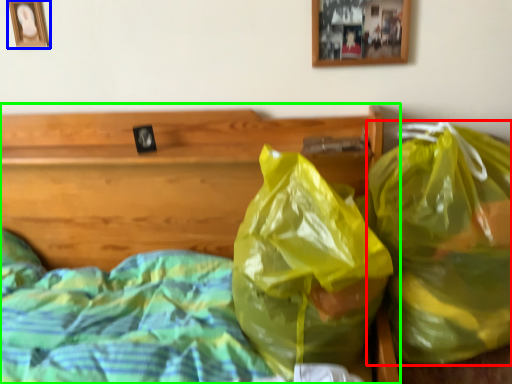
Question: Which object is the farthest from plastic bag (highlighted by a red box)? Choose among these: picture frame (highlighted by a blue box) or bed (highlighted by a green box).

Choices:
 (A) picture frame
 (B) bed

Answer: (A)